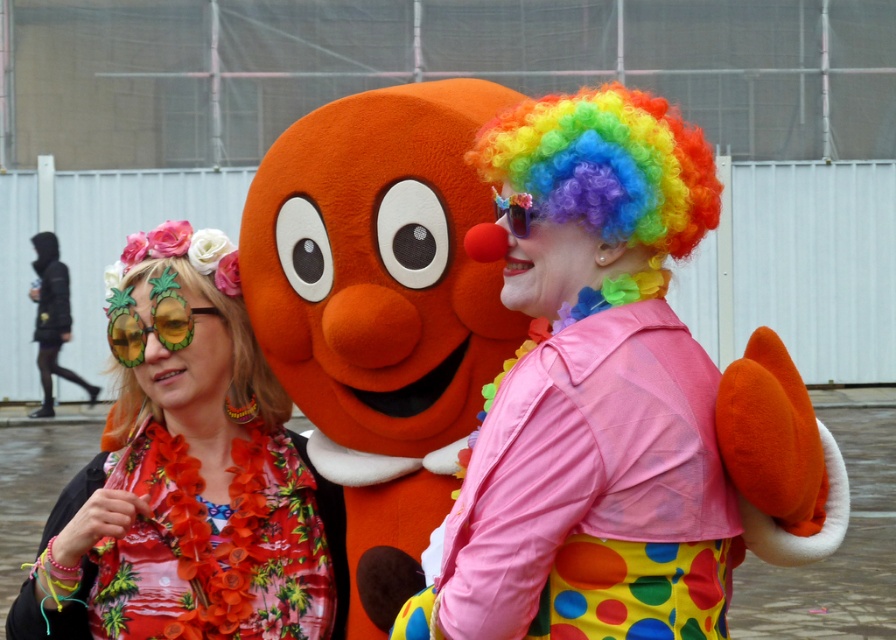
Does point (116, 560) come closer to viewer compared to point (242, 310)?

That is True.

Can you confirm if floral fabric lei at left is positioned above floral fabric wig at upper left?

No, floral fabric lei at left is not above floral fabric wig at upper left.

The width and height of the screenshot is (896, 640). Find the location of `floral fabric lei at left`. floral fabric lei at left is located at coordinates (185, 474).

This screenshot has height=640, width=896. What are the coordinates of `yellowtransparentgoggles at left` in the screenshot? It's located at (151, 323).

Is floral fabric wig at upper left wider than shiny plastic sunglasses at center?

Correct, the width of floral fabric wig at upper left exceeds that of shiny plastic sunglasses at center.

In order to click on floral fabric wig at upper left in this screenshot , I will do `click(229, 339)`.

Which is in front, point (157, 260) or point (524, 211)?

Point (524, 211) is more forward.

Identify the location of floral fabric wig at upper left. (229, 339).